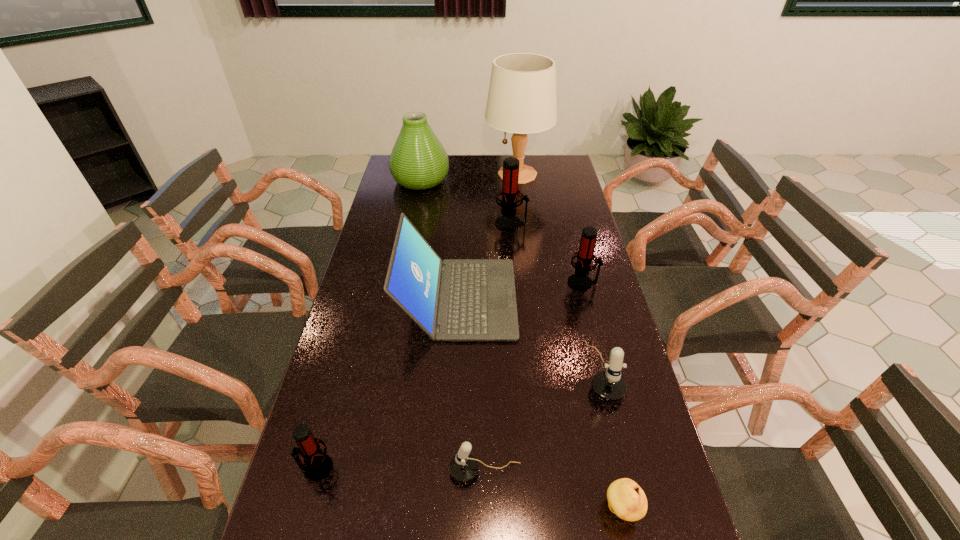
This screenshot has width=960, height=540. Find the location of `table lamp`. table lamp is located at coordinates (522, 99).

Find the location of a particular element. Image resolution: width=960 pixels, height=540 pixels. beige table lamp is located at coordinates (522, 99).

The height and width of the screenshot is (540, 960). I want to click on green vase, so click(418, 161).

Locate an element on the screen. The image size is (960, 540). the farthest microphone is located at coordinates (508, 222).

Locate an element on the screen. This screenshot has height=540, width=960. the farthest red microphone is located at coordinates (508, 222).

Image resolution: width=960 pixels, height=540 pixels. In order to click on the fourth nearest microphone in this screenshot , I will do `click(579, 281)`.

Where is `the second biggest red microphone`? The height and width of the screenshot is (540, 960). the second biggest red microphone is located at coordinates (579, 281).

The width and height of the screenshot is (960, 540). I want to click on laptop computer, so click(455, 299).

I want to click on the third farthest microphone, so click(608, 385).

The height and width of the screenshot is (540, 960). I want to click on the right white microphone, so click(x=608, y=385).